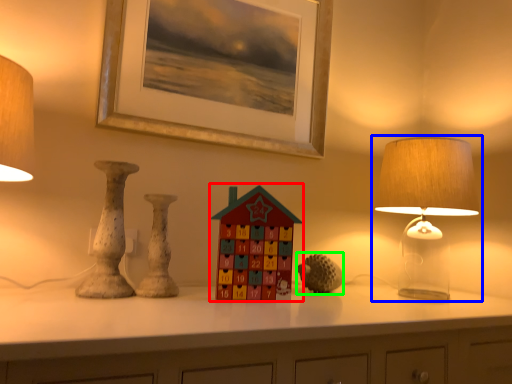
Question: Considering the real-world distances, which object is farthest from toy (highlighted by a red box)? lamp (highlighted by a blue box) or toy (highlighted by a green box)?

Choices:
 (A) lamp
 (B) toy

Answer: (A)